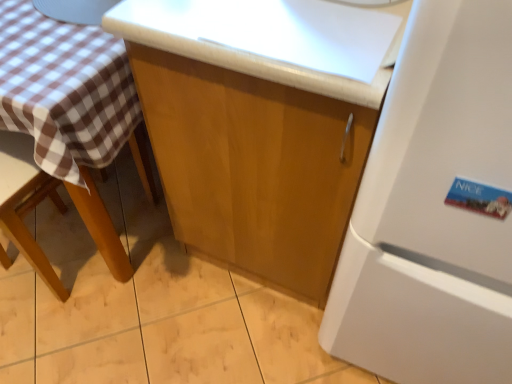
Identify the location of free point in front of brown wooden chair at left. (53, 328).